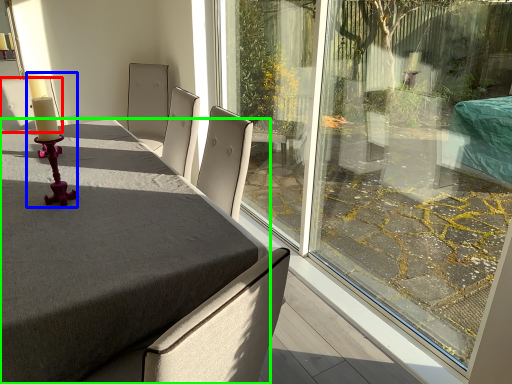
Question: Which object is positioned closest to chair (highlighted by a red box)? Select from candle holder (highlighted by a blue box) and table (highlighted by a green box).

Choices:
 (A) candle holder
 (B) table

Answer: (A)